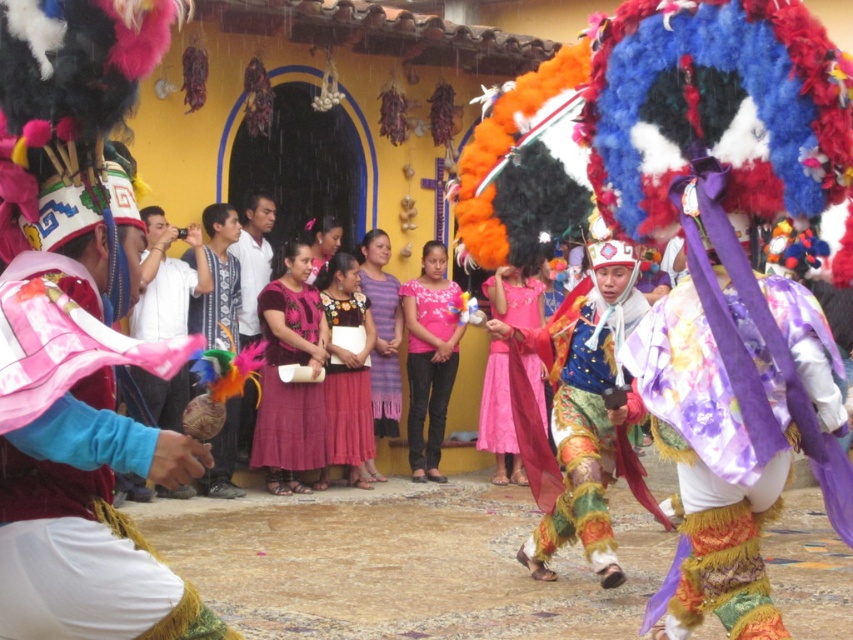
You are a photographer at the festival and want to capture a closeup shot of both the floral silk skirt at center and the multicolored feathered headdress at center. Which object should you zoom in on more to ensure both are in focus?

The floral silk skirt at center has a smaller size compared to multicolored feathered headdress at center. To ensure both are in focus, you should zoom in more on the smaller floral silk skirt at center so that its details are clear while the larger headdress remains in frame.

In the scene shown: You are a photographer at the festival and want to capture a photo that includes both the matte pink fabric at left and the purple woven dress at center. Which object should you focus on first to ensure both are in the frame?

You should focus on the matte pink fabric at left first because it is closer to the viewer than the purple woven dress at center, ensuring both are in focus when using depth of field.